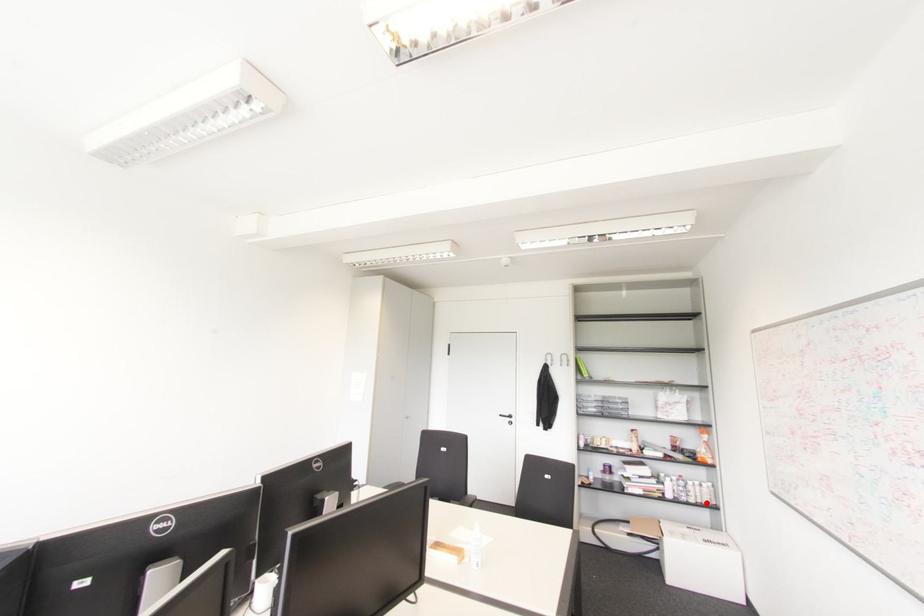
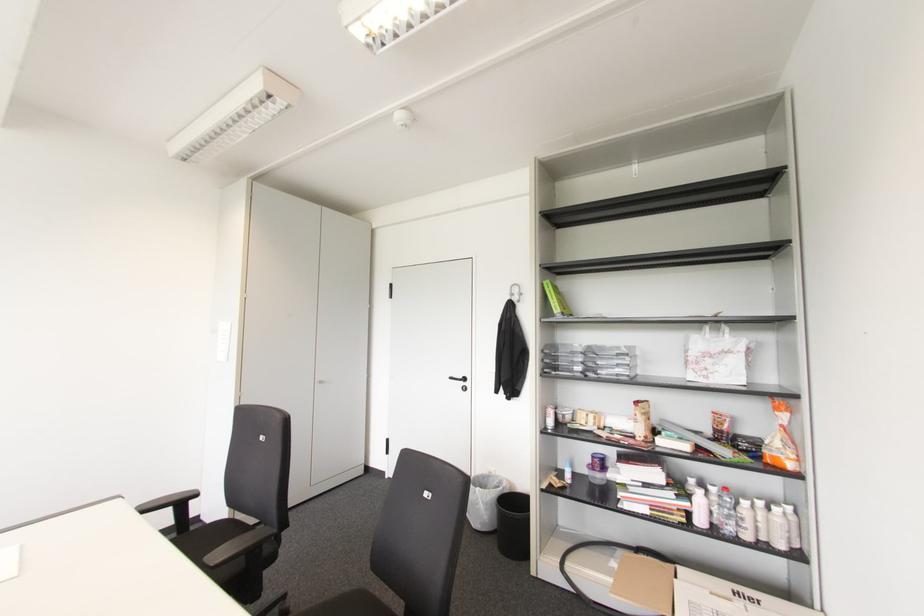
Question: I am providing you with two images of the same scene from different viewpoints. In image1, a red point is highlighted. Considering the same 3D point in image2, which of the following is correct?

Choices:
 (A) It is closer
 (B) It is farther

Answer: (A)